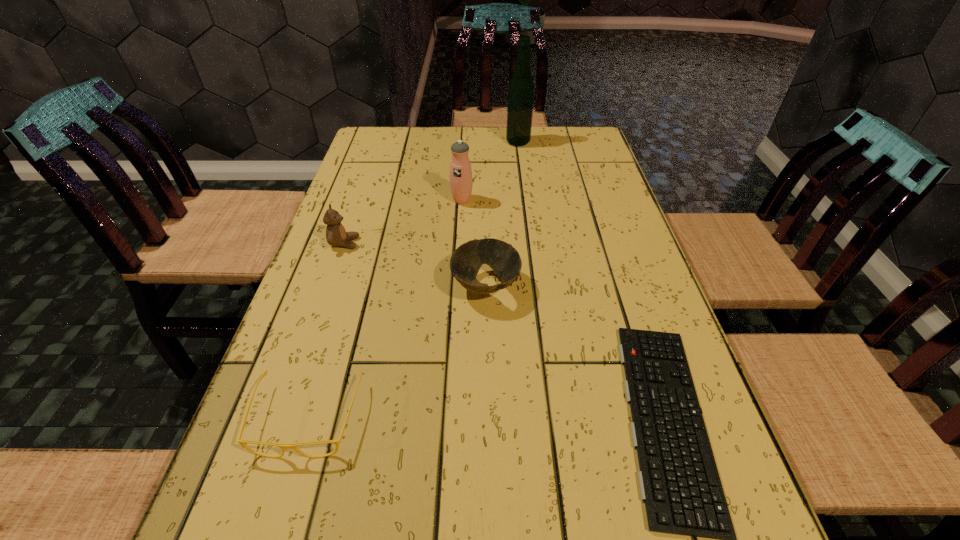
You are a GUI agent. You are given a task and a screenshot of the screen. Output one action in this format:
    pyautogui.click(x=<x>, y=<y>)
    Task: Click on the alcohol
    This screenshot has height=540, width=960.
    Given the screenshot: What is the action you would take?
    pyautogui.click(x=521, y=88)

The width and height of the screenshot is (960, 540). In order to click on the farthest object in this screenshot , I will do `click(521, 88)`.

The width and height of the screenshot is (960, 540). What are the coordinates of `the fifth nearest object` in the screenshot? It's located at (461, 180).

Identify the location of thermos bottle. (461, 180).

Locate an element on the screen. the third tallest object is located at coordinates (336, 235).

The image size is (960, 540). I want to click on teddy bear, so click(336, 235).

Image resolution: width=960 pixels, height=540 pixels. In order to click on the fourth farthest object in this screenshot , I will do `click(467, 259)`.

The width and height of the screenshot is (960, 540). In order to click on bowl in this screenshot , I will do `click(467, 259)`.

The image size is (960, 540). In order to click on spectacles in this screenshot , I will do `click(283, 446)`.

Where is `blank space located on the left of the farthest object`? blank space located on the left of the farthest object is located at coordinates (431, 142).